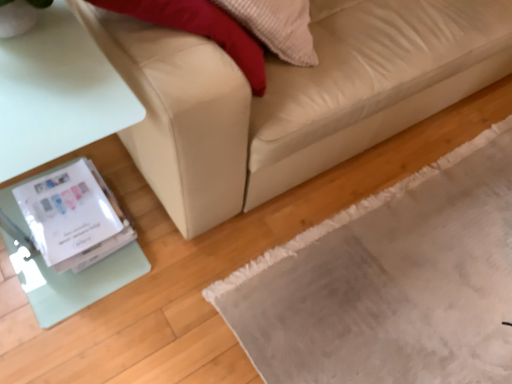
What do you see at coordinates (292, 96) in the screenshot?
I see `beige leather couch at lower left` at bounding box center [292, 96].

What is the approximate height of beige leather couch at lower left?

beige leather couch at lower left is 33.59 inches in height.

You are a GUI agent. You are given a task and a screenshot of the screen. Output one action in this format:
    pyautogui.click(x=<x>, y=<y>)
    Task: Click on the gray textured mat at lower right
    This screenshot has height=384, width=512.
    Given the screenshot: What is the action you would take?
    pyautogui.click(x=391, y=282)

The height and width of the screenshot is (384, 512). Describe the element at coordinates (73, 217) in the screenshot. I see `white glossy wii at lower left` at that location.

What are the coordinates of `white glossy wii at lower left` in the screenshot? It's located at (73, 217).

In order to click on beige leather couch at lower left in this screenshot , I will do `click(292, 96)`.

Can you confirm if white glossy wii at lower left is bigger than beige leather couch at lower left?

No, white glossy wii at lower left is not bigger than beige leather couch at lower left.

From the image's perspective, is white glossy wii at lower left located above or below beige leather couch at lower left?

From the image's perspective, white glossy wii at lower left appears below beige leather couch at lower left.

Which point is more distant from viewer, (55, 250) or (239, 92)?

Point (55, 250)

Is beige leather couch at lower left completely or partially inside white glossy wii at lower left?

No, beige leather couch at lower left is not a part of white glossy wii at lower left.

You are a GUI agent. You are given a task and a screenshot of the screen. Output one action in this format:
    pyautogui.click(x=<x>, y=<y>)
    Task: Click on the mat below the white glossy wii at lower left (from a real-world perspective)
    The width and height of the screenshot is (512, 384).
    Given the screenshot: What is the action you would take?
    pyautogui.click(x=391, y=282)

Considering the positions of point (93, 182) and point (475, 257), is point (93, 182) closer or farther from the camera than point (475, 257)?

Point (93, 182).

From the image's perspective, is white glossy wii at lower left below gray textured mat at lower right?

No.

From a real-world perspective, is white glossy wii at lower left over gray textured mat at lower right?

Yes, from a real-world perspective, white glossy wii at lower left is above gray textured mat at lower right.

From a real-world perspective, which is physically above, beige leather couch at lower left or gray textured mat at lower right?

beige leather couch at lower left.

Can you confirm if beige leather couch at lower left is positioned to the left of gray textured mat at lower right?

Indeed, beige leather couch at lower left is positioned on the left side of gray textured mat at lower right.

Measure the distance between beige leather couch at lower left and gray textured mat at lower right.

42.07 centimeters.

Are gray textured mat at lower right and white glossy wii at lower left located far from each other?

Actually, gray textured mat at lower right and white glossy wii at lower left are a little close together.

Could you tell me if gray textured mat at lower right is facing white glossy wii at lower left?

No.

Would you say white glossy wii at lower left is part of gray textured mat at lower right's contents?

Actually, white glossy wii at lower left is outside gray textured mat at lower right.

Can we say beige leather couch at lower left lies outside white glossy wii at lower left?

beige leather couch at lower left lies outside white glossy wii at lower left's area.

Does beige leather couch at lower left have a smaller size compared to white glossy wii at lower left?

No, beige leather couch at lower left is not smaller than white glossy wii at lower left.

Is the position of beige leather couch at lower left less distant than that of white glossy wii at lower left?

Yes, the depth of beige leather couch at lower left is less than that of white glossy wii at lower left.

Based on the photo, is gray textured mat at lower right wider than beige leather couch at lower left?

Indeed, gray textured mat at lower right has a greater width compared to beige leather couch at lower left.

Find the location of a particular element. mat that appears behind the beige leather couch at lower left is located at coordinates (391, 282).

From their relative heights in the image, would you say gray textured mat at lower right is taller or shorter than beige leather couch at lower left?

Considering their sizes, gray textured mat at lower right has less height than beige leather couch at lower left.

At what (x,y) coordinates should I click in order to perform the action: click on Wii that is on the left side of beige leather couch at lower left. Please return your answer as a coordinate pair (x, y). Looking at the image, I should click on (73, 217).

Where is `mat on the right of white glossy wii at lower left`? mat on the right of white glossy wii at lower left is located at coordinates (391, 282).

Estimate the real-world distances between objects in this image. Which object is further from white glossy wii at lower left, beige leather couch at lower left or gray textured mat at lower right?

gray textured mat at lower right.

When comparing their distances from gray textured mat at lower right, does beige leather couch at lower left or white glossy wii at lower left seem further?

Based on the image, white glossy wii at lower left appears to be further to gray textured mat at lower right.

Which object lies nearer to the anchor point gray textured mat at lower right, white glossy wii at lower left or beige leather couch at lower left?

beige leather couch at lower left is closer to gray textured mat at lower right.

From the image, which object appears to be farther from white glossy wii at lower left, gray textured mat at lower right or beige leather couch at lower left?

gray textured mat at lower right lies further to white glossy wii at lower left than the other object.

When comparing their distances from beige leather couch at lower left, does white glossy wii at lower left or gray textured mat at lower right seem closer?

gray textured mat at lower right.

When comparing their distances from beige leather couch at lower left, does gray textured mat at lower right or white glossy wii at lower left seem further?

white glossy wii at lower left.

The image size is (512, 384). Find the location of `studio couch between white glossy wii at lower left and gray textured mat at lower right in the horizontal direction`. studio couch between white glossy wii at lower left and gray textured mat at lower right in the horizontal direction is located at coordinates (292, 96).